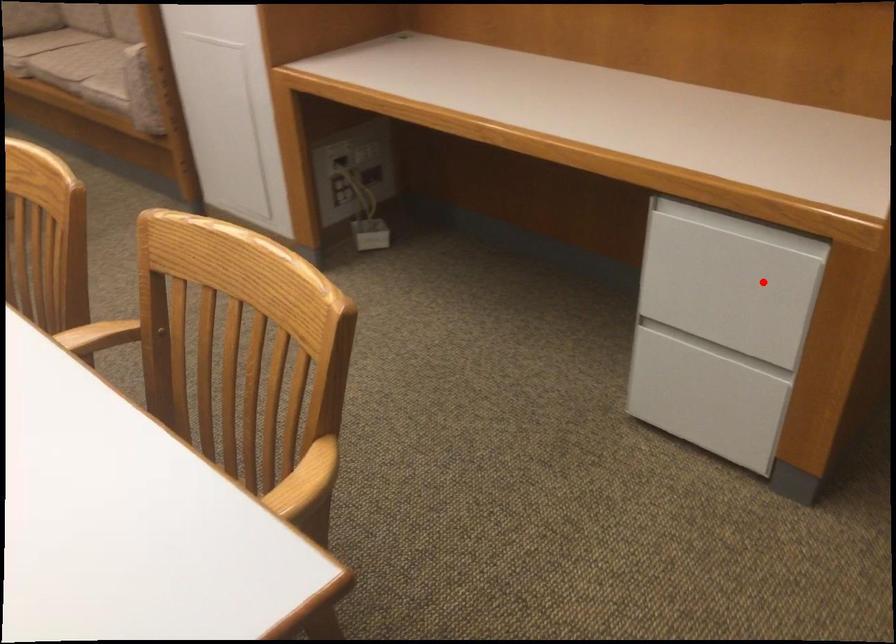
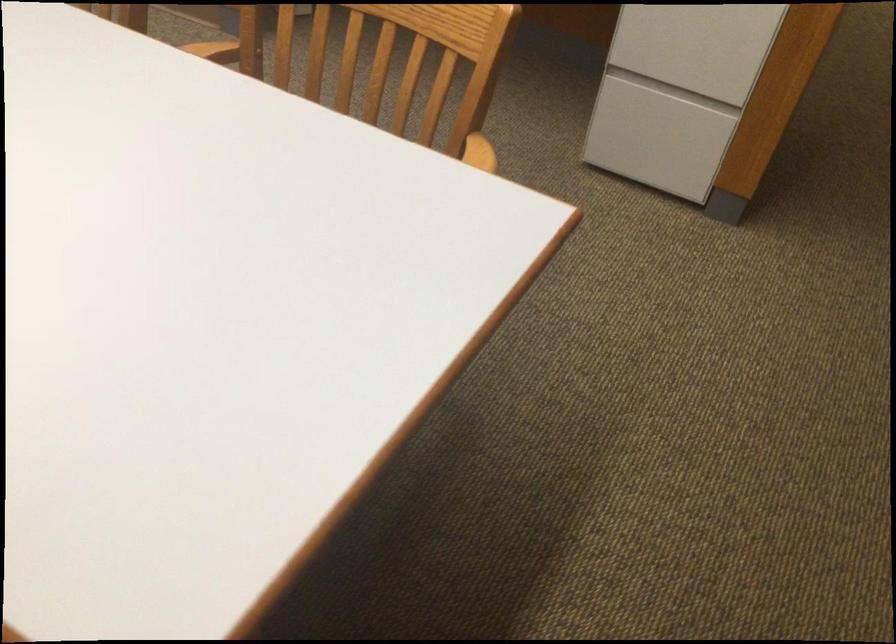
Question: I am providing you with two images of the same scene from different viewpoints. A red point is shown in image1. For the corresponding object point in image2, is it positioned nearer or farther from the camera?

Choices:
 (A) Nearer
 (B) Farther

Answer: (B)